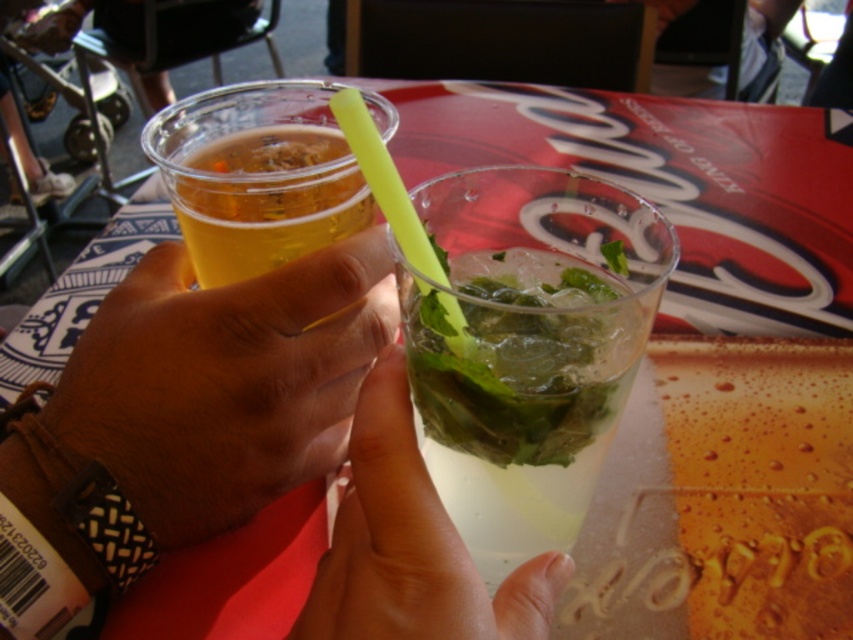
You are a bartender trying to place a small garnish between the smooth skin hand at center and the translucent glass at center. Can you fit it there?

The distance between the smooth skin hand at center and the translucent glass at center is 2.28 inches, so yes, you can fit a small garnish there as it likely has enough space.

You are a photographer trying to focus on the point at coordinates point (397, 625). The camera can only focus on objects within 15 centimeters. Will the camera be able to focus on that point?

The point (397, 625) is 16.63 centimeters from the camera, which is beyond the camera focus range of 15 centimeters. Therefore, the camera will not be able to focus on that point.

You are at an outdoor cafe and notice two glasses at the center of your view. The clear glass at center and the translucent glass at center. Which one is positioned higher?

The clear glass at center is located above the translucent glass at center, so the clear glass at center is positioned higher.